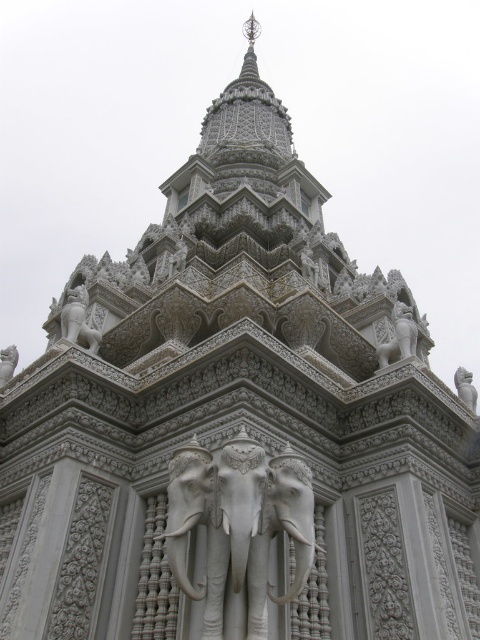
You are an architect examining the temple structure. You need to determine which of the two statues, the white stone elephants at center or the white stone lion at upper left, has a greater width. Based on the provided information, which one is wider?

The white stone elephants at center have a greater width than the white stone lion at upper left.

Consider the image. You are an architect examining the temple structure. You need to locate the white stone lion at upper left. According to the coordinates provided, where exactly is it positioned?

The white stone lion at upper left is located at point (79,320).